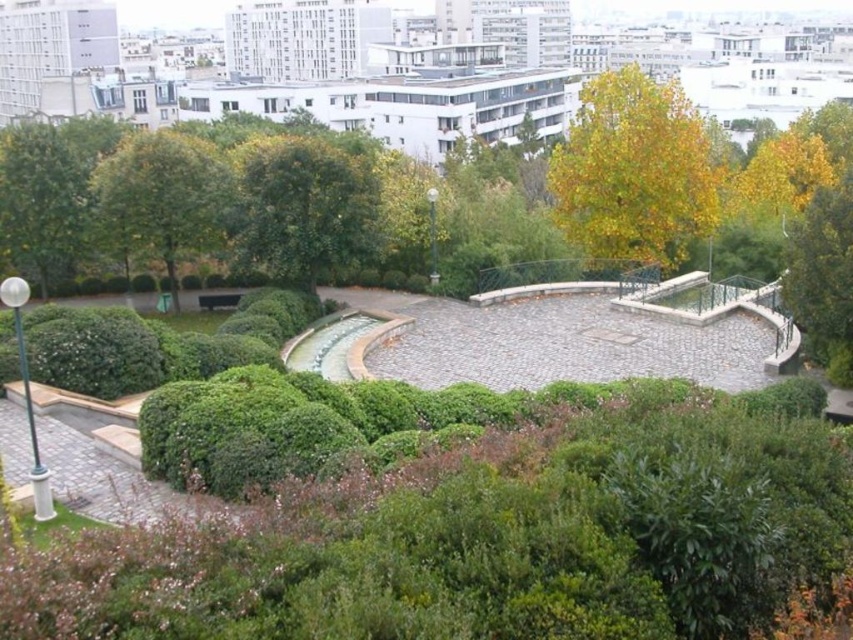
Is yellow-green leaves at upper center positioned at the back of green leafy tree at upper left?

Yes, it is behind green leafy tree at upper left.

Is point (664, 148) less distant than point (170, 276)?

That is False.

Locate an element on the screen. yellow-green leaves at upper center is located at coordinates (635, 172).

Image resolution: width=853 pixels, height=640 pixels. Find the location of `yellow-green leaves at upper center`. yellow-green leaves at upper center is located at coordinates (635, 172).

Does green leafy tree at center appear on the right side of green leafy tree at upper left?

Correct, you'll find green leafy tree at center to the right of green leafy tree at upper left.

Who is positioned more to the right, green leafy tree at center or green leafy tree at upper left?

green leafy tree at center is more to the right.

Measure the distance between green leafy tree at center and camera.

A distance of 38.52 meters exists between green leafy tree at center and camera.

Locate an element on the screen. The height and width of the screenshot is (640, 853). green leafy tree at center is located at coordinates (305, 208).

Is yellow-green leaves at upper center bigger than green leafy tree at center?

Yes.

Which is behind, point (618, 156) or point (367, 195)?

Point (618, 156)

Locate an element on the screen. yellow-green leaves at upper center is located at coordinates (635, 172).